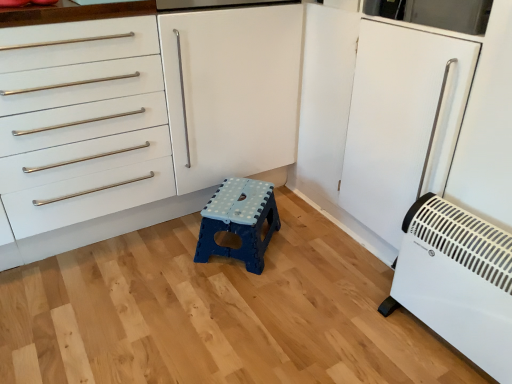
Find the location of a particular element. The image size is (512, 384). vacant space situated on the left part of blue plastic stool at center is located at coordinates (162, 254).